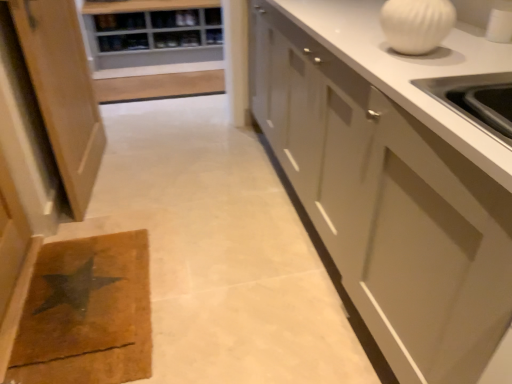
Question: Is white glossy vase at upper right behind light brown wood cabinet at left, which is counted as the first cabinetry, starting from the left?

Choices:
 (A) no
 (B) yes

Answer: (A)

Question: Is the surface of white glossy vase at upper right in direct contact with light brown wood cabinet at left, the second cabinetry viewed from the right?

Choices:
 (A) no
 (B) yes

Answer: (A)

Question: Does white glossy vase at upper right have a lesser height compared to light brown wood cabinet at left, which is counted as the first cabinetry, starting from the left?

Choices:
 (A) yes
 (B) no

Answer: (A)

Question: Is white glossy vase at upper right wider than light brown wood cabinet at left, which is counted as the first cabinetry, starting from the left?

Choices:
 (A) yes
 (B) no

Answer: (A)

Question: Is light brown wood cabinet at left, which is counted as the first cabinetry, starting from the left, inside white glossy vase at upper right?

Choices:
 (A) no
 (B) yes

Answer: (A)

Question: From the image's perspective, is white glossy vase at upper right above light brown wood cabinet at left, the second cabinetry viewed from the right?

Choices:
 (A) yes
 (B) no

Answer: (B)

Question: Is white glossy vase at upper right positioned before brown/cork doormat at lower left?

Choices:
 (A) no
 (B) yes

Answer: (B)

Question: Considering the relative sizes of white glossy vase at upper right and brown/cork doormat at lower left in the image provided, is white glossy vase at upper right bigger than brown/cork doormat at lower left?

Choices:
 (A) yes
 (B) no

Answer: (B)

Question: Is white glossy vase at upper right not inside brown/cork doormat at lower left?

Choices:
 (A) no
 (B) yes

Answer: (B)

Question: From the image's perspective, is white glossy vase at upper right on top of brown/cork doormat at lower left?

Choices:
 (A) yes
 (B) no

Answer: (A)

Question: Considering the relative sizes of white glossy vase at upper right and brown/cork doormat at lower left in the image provided, is white glossy vase at upper right thinner than brown/cork doormat at lower left?

Choices:
 (A) yes
 (B) no

Answer: (A)

Question: Is white glossy vase at upper right wider than brown/cork doormat at lower left?

Choices:
 (A) no
 (B) yes

Answer: (A)

Question: Is wooden shelf at upper center positioned with its back to white glossy vase at upper right?

Choices:
 (A) no
 (B) yes

Answer: (A)